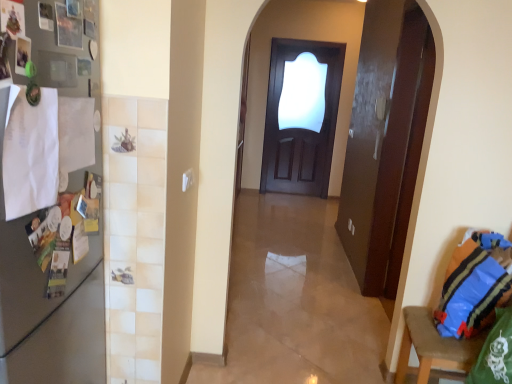
Find the location of `dark wood door at center`. dark wood door at center is located at coordinates (300, 125).

The width and height of the screenshot is (512, 384). Find the location of `blue striped fabric pillow at right`. blue striped fabric pillow at right is located at coordinates (471, 292).

Between point (73, 48) and point (463, 336), which one is positioned in front?

Point (73, 48)

Considering the relative positions of satin silver fridge at left and blue striped fabric pillow at right in the image provided, is satin silver fridge at left to the right of blue striped fabric pillow at right from the viewer's perspective?

In fact, satin silver fridge at left is to the left of blue striped fabric pillow at right.

Based on the photo, is satin silver fridge at left positioned beyond the bounds of blue striped fabric pillow at right?

satin silver fridge at left is positioned outside blue striped fabric pillow at right.

Which object is positioned more to the left, dark wood door at center or satin silver fridge at left?

Positioned to the left is satin silver fridge at left.

Which object is closer to the camera taking this photo, dark wood door at center or satin silver fridge at left?

satin silver fridge at left is closer to the camera.

Measure the distance between dark wood door at center and satin silver fridge at left.

dark wood door at center and satin silver fridge at left are 4.74 meters apart.

In terms of width, does dark wood door at center look wider or thinner when compared to satin silver fridge at left?

Considering their sizes, dark wood door at center looks slimmer than satin silver fridge at left.

Where is `fridge above the blue fabric bag at lower right (from a real-world perspective)`? Image resolution: width=512 pixels, height=384 pixels. fridge above the blue fabric bag at lower right (from a real-world perspective) is located at coordinates pos(47,308).

Does satin silver fridge at left touch blue fabric bag at lower right?

No, satin silver fridge at left is not in contact with blue fabric bag at lower right.

Does satin silver fridge at left appear on the right side of blue fabric bag at lower right?

No, satin silver fridge at left is not to the right of blue fabric bag at lower right.

The width and height of the screenshot is (512, 384). Identify the location of pillow that appears on the right of blue fabric bag at lower right. (471, 292).

From the image's perspective, does blue striped fabric pillow at right appear lower than blue fabric bag at lower right?

Incorrect, from the image's perspective, blue striped fabric pillow at right is higher than blue fabric bag at lower right.

Is point (467, 255) farther from camera compared to point (509, 252)?

Yes, it is behind point (509, 252).

Which object is thinner, blue striped fabric pillow at right or blue fabric bag at lower right?

Thinner between the two is blue striped fabric pillow at right.

Is blue fabric bag at lower right with dark wood door at center?

blue fabric bag at lower right and dark wood door at center are not in contact.

Is the depth of blue fabric bag at lower right greater than that of dark wood door at center?

No.

Is blue fabric bag at lower right oriented towards dark wood door at center?

No, blue fabric bag at lower right is not turned towards dark wood door at center.

How much distance is there between satin silver fridge at left and dark wood door at center?

A distance of 4.74 meters exists between satin silver fridge at left and dark wood door at center.

Is satin silver fridge at left turned away from dark wood door at center?

No, satin silver fridge at left's orientation is not away from dark wood door at center.

Considering the sizes of satin silver fridge at left and dark wood door at center in the image, is satin silver fridge at left wider or thinner than dark wood door at center?

satin silver fridge at left is wider than dark wood door at center.

Is satin silver fridge at left next to dark wood door at center?

No, satin silver fridge at left is not in contact with dark wood door at center.

From a real-world perspective, which object rests below the other?

From a 3D spatial view, blue fabric bag at lower right is below.

At what (x,y) coordinates should I click in order to perform the action: click on armchair located on the left of blue striped fabric pillow at right. Please return your answer as a coordinate pair (x, y). This screenshot has height=384, width=512. Looking at the image, I should click on (432, 346).

Can you see blue fabric bag at lower right touching blue striped fabric pillow at right?

Yes, the surface of blue fabric bag at lower right is in contact with blue striped fabric pillow at right.

Where is `pillow below the satin silver fridge at left (from a real-world perspective)`? This screenshot has height=384, width=512. pillow below the satin silver fridge at left (from a real-world perspective) is located at coordinates (471, 292).

Where is `fridge in front of the dark wood door at center`? The width and height of the screenshot is (512, 384). fridge in front of the dark wood door at center is located at coordinates (47, 308).

From the image, which object appears to be nearer to blue striped fabric pillow at right, satin silver fridge at left or blue fabric bag at lower right?

blue fabric bag at lower right lies closer to blue striped fabric pillow at right than the other object.

Estimate the real-world distances between objects in this image. Which object is closer to dark wood door at center, blue fabric bag at lower right or satin silver fridge at left?

blue fabric bag at lower right is closer to dark wood door at center.

Based on the photo, considering their positions, is blue striped fabric pillow at right positioned further to satin silver fridge at left than dark wood door at center?

dark wood door at center.

Which object lies further to the anchor point blue fabric bag at lower right, blue striped fabric pillow at right or satin silver fridge at left?

satin silver fridge at left lies further to blue fabric bag at lower right than the other object.

Estimate the real-world distances between objects in this image. Which object is further from blue striped fabric pillow at right, blue fabric bag at lower right or satin silver fridge at left?

satin silver fridge at left lies further to blue striped fabric pillow at right than the other object.

When comparing their distances from satin silver fridge at left, does dark wood door at center or blue fabric bag at lower right seem further?

dark wood door at center lies further to satin silver fridge at left than the other object.

Estimate the real-world distances between objects in this image. Which object is further from blue fabric bag at lower right, satin silver fridge at left or blue striped fabric pillow at right?

Among the two, satin silver fridge at left is located further to blue fabric bag at lower right.

Estimate the real-world distances between objects in this image. Which object is further from satin silver fridge at left, blue striped fabric pillow at right or blue fabric bag at lower right?

Among the two, blue striped fabric pillow at right is located further to satin silver fridge at left.

Locate an element on the screen. This screenshot has height=384, width=512. pillow between blue fabric bag at lower right and dark wood door at center from front to back is located at coordinates (471, 292).

The height and width of the screenshot is (384, 512). Find the location of `pillow between satin silver fridge at left and dark wood door at center from front to back`. pillow between satin silver fridge at left and dark wood door at center from front to back is located at coordinates (471, 292).

Image resolution: width=512 pixels, height=384 pixels. I want to click on armchair between satin silver fridge at left and dark wood door at center in the front-back direction, so click(x=432, y=346).

This screenshot has height=384, width=512. I want to click on armchair located between satin silver fridge at left and blue striped fabric pillow at right in the left-right direction, so 432,346.